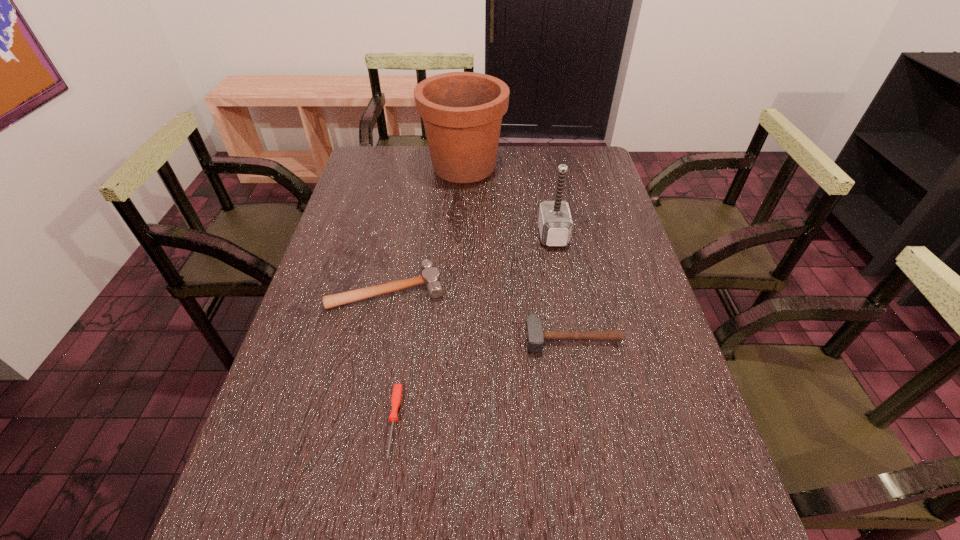
The height and width of the screenshot is (540, 960). I want to click on free space between the second nearest hammer and the second tallest object, so click(470, 261).

Where is `free spot between the second farthest object and the second farthest hammer`? The image size is (960, 540). free spot between the second farthest object and the second farthest hammer is located at coordinates (470, 261).

Where is `object that stands as the third closest to the farthest object`? This screenshot has width=960, height=540. object that stands as the third closest to the farthest object is located at coordinates (535, 336).

Identify which object is the nearest to the nearest hammer. Please provide its 2D coordinates. Your answer should be formatted as a tuple, i.e. [(x, y)], where the tuple contains the x and y coordinates of a point satisfying the conditions above.

[(430, 277)]

Select which hammer appears as the third closest to the tallest object. Please provide its 2D coordinates. Your answer should be formatted as a tuple, i.e. [(x, y)], where the tuple contains the x and y coordinates of a point satisfying the conditions above.

[(535, 336)]

Select which hammer appears as the closest to the third nearest object. Please provide its 2D coordinates. Your answer should be formatted as a tuple, i.e. [(x, y)], where the tuple contains the x and y coordinates of a point satisfying the conditions above.

[(535, 336)]